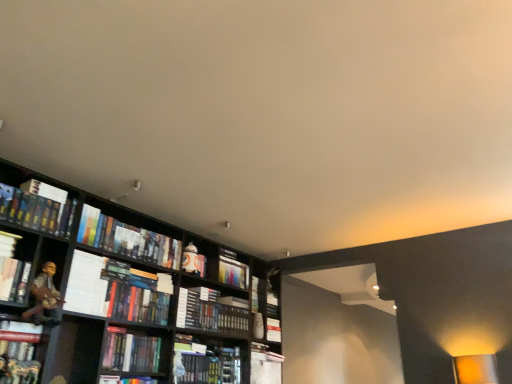
This screenshot has height=384, width=512. Find the location of `hardcover book at upper center, acting as the ninth book starting from the left`. hardcover book at upper center, acting as the ninth book starting from the left is located at coordinates (272, 304).

Measure the distance between hardcover book at center, positioned as the first book in right-to-left order, and camera.

A distance of 3.58 meters exists between hardcover book at center, positioned as the first book in right-to-left order, and camera.

The width and height of the screenshot is (512, 384). In order to click on hardcover book at left, positioned as the third book in left-to-right order in this screenshot , I will do `click(128, 239)`.

This screenshot has height=384, width=512. What do you see at coordinates (128, 239) in the screenshot? I see `hardcover book at left, positioned as the third book in left-to-right order` at bounding box center [128, 239].

What is the approximate height of white paper at left?

The height of white paper at left is 12.63 inches.

What do you see at coordinates (193, 261) in the screenshot? I see `white glossy figurine at center, which is the 6th book in left-to-right order` at bounding box center [193, 261].

Where is `hardcover book at upper center, acting as the ninth book starting from the left`? The height and width of the screenshot is (384, 512). hardcover book at upper center, acting as the ninth book starting from the left is located at coordinates (272, 304).

Are white paper at left and hardcover books at center, which is the seventh book from left to right, far apart?

No, white paper at left is not far away from hardcover books at center, which is the seventh book from left to right.

Between white paper at left and hardcover books at center, placed as the fourth book when sorted from right to left, which one has less height?

hardcover books at center, placed as the fourth book when sorted from right to left, is shorter.

What's the angular difference between white paper at left and hardcover books at center, placed as the fourth book when sorted from right to left,'s facing directions?

0.877 degrees.

Between white paper at left and hardcover books at center, placed as the fourth book when sorted from right to left, which one has smaller size?

With smaller size is white paper at left.

Does hardcover book at upper center, acting as the ninth book starting from the left, have a lesser height compared to hardcover book at center, the 7th book positioned from the right?

Yes.

Is hardcover book at upper center, arranged as the 2th book when viewed from the right, to the right of hardcover book at center, the 7th book positioned from the right, from the viewer's perspective?

Yes.

Is hardcover book at upper center, arranged as the 2th book when viewed from the right, positioned beyond the bounds of hardcover book at center, the fourth book positioned from the left?

Indeed, hardcover book at upper center, arranged as the 2th book when viewed from the right, is completely outside hardcover book at center, the fourth book positioned from the left.

At what (x,y) coordinates should I click in order to perform the action: click on book that is the 5th object located in front of the hardcover book at upper center, arranged as the 2th book when viewed from the right. Please return your answer as a coordinate pair (x, y). Looking at the image, I should click on (131, 351).

Is hardcover books at center, which is the seventh book from left to right, not close to hardcover book at center, positioned as the first book in right-to-left order?

No, hardcover books at center, which is the seventh book from left to right, is in close proximity to hardcover book at center, positioned as the first book in right-to-left order.

Can you confirm if hardcover books at center, placed as the fourth book when sorted from right to left, is smaller than hardcover book at center, positioned as the first book in right-to-left order?

Actually, hardcover books at center, placed as the fourth book when sorted from right to left, might be larger than hardcover book at center, positioned as the first book in right-to-left order.

Which is farther, (192, 300) or (277, 339)?

The point (277, 339) is farther.

From the image's perspective, is hardcover book at left, acting as the 10th book starting from the right, below white paper at left?

Incorrect, from the image's perspective, hardcover book at left, acting as the 10th book starting from the right, is higher than white paper at left.

Is hardcover book at left, the 1th book positioned from the left, not close to white paper at left?

No, hardcover book at left, the 1th book positioned from the left, is not far away from white paper at left.

Could you measure the distance between hardcover book at left, acting as the 10th book starting from the right, and white paper at left?

The distance of hardcover book at left, acting as the 10th book starting from the right, from white paper at left is 12.31 inches.

In terms of height, does hardcover book at left, the 1th book positioned from the left, look taller or shorter compared to white paper at left?

Considering their sizes, hardcover book at left, the 1th book positioned from the left, has less height than white paper at left.

Does hardcover book at upper center, arranged as the 2th book when viewed from the right, have a greater width compared to hardcover books at center, which is the seventh book from left to right?

No, hardcover book at upper center, arranged as the 2th book when viewed from the right, is not wider than hardcover books at center, which is the seventh book from left to right.

Is hardcover book at upper center, arranged as the 2th book when viewed from the right, next to hardcover books at center, placed as the fourth book when sorted from right to left, and touching it?

There is a gap between hardcover book at upper center, arranged as the 2th book when viewed from the right, and hardcover books at center, placed as the fourth book when sorted from right to left.

Is hardcover book at upper center, arranged as the 2th book when viewed from the right, positioned beyond the bounds of hardcover books at center, which is the seventh book from left to right?

Yes, hardcover book at upper center, arranged as the 2th book when viewed from the right, is not within hardcover books at center, which is the seventh book from left to right.

From the image's perspective, is hardcover book at upper center, arranged as the 2th book when viewed from the right, located above hardcover books at center, placed as the fourth book when sorted from right to left?

Actually, hardcover book at upper center, arranged as the 2th book when viewed from the right, appears below hardcover books at center, placed as the fourth book when sorted from right to left, in the image.

From the image's perspective, is hardcover book at center, the tenth book from the left, positioned above or below hardcover book at center, arranged as the 5th book when viewed from the left?

hardcover book at center, the tenth book from the left, is below hardcover book at center, arranged as the 5th book when viewed from the left.

Does point (269, 334) appear closer or farther from the camera than point (149, 320)?

Point (269, 334) is farther from the camera than point (149, 320).

Can you confirm if hardcover book at center, the tenth book from the left, is thinner than hardcover book at center, marked as the sixth book in a right-to-left arrangement?

Yes.

Which object is positioned more to the right, hardcover book at center, the tenth book from the left, or hardcover book at center, marked as the sixth book in a right-to-left arrangement?

Positioned to the right is hardcover book at center, the tenth book from the left.

Is the depth of hardcover book at center, marked as the sixth book in a right-to-left arrangement, greater than that of white paper at left?

Yes.

From the picture: Considering the sizes of objects hardcover book at center, marked as the sixth book in a right-to-left arrangement, and white paper at left in the image provided, who is smaller, hardcover book at center, marked as the sixth book in a right-to-left arrangement, or white paper at left?

Smaller between the two is white paper at left.

How different are the orientations of hardcover book at center, arranged as the 5th book when viewed from the left, and white paper at left in degrees?

The facing directions of hardcover book at center, arranged as the 5th book when viewed from the left, and white paper at left are 0.00128 degrees apart.

Is hardcover book at center, marked as the sixth book in a right-to-left arrangement, facing towards white paper at left?

No, hardcover book at center, marked as the sixth book in a right-to-left arrangement, is not turned towards white paper at left.

From the image's perspective, count 5th books downward from the white paper at left and point to it. Please provide its 2D coordinates.

[(210, 313)]

Where is `book that is the 5th one when counting leftward from the hardcover book at upper center, arranged as the 2th book when viewed from the right`? This screenshot has width=512, height=384. book that is the 5th one when counting leftward from the hardcover book at upper center, arranged as the 2th book when viewed from the right is located at coordinates (131, 351).

Considering their positions, is hardcover book at center, arranged as the 5th book when viewed from the left, positioned closer to hardcover book at upper center, arranged as the 2th book when viewed from the right, than white glossy figurine at center, acting as the fifth book starting from the right?

The object closer to hardcover book at upper center, arranged as the 2th book when viewed from the right, is white glossy figurine at center, acting as the fifth book starting from the right.

Based on the photo, based on their spatial positions, is hardcover book at left, acting as the 10th book starting from the right, or hardcover book at upper center, arranged as the 2th book when viewed from the right, further from hardcover book at center, the tenth book from the left?

hardcover book at left, acting as the 10th book starting from the right, is positioned further to the anchor hardcover book at center, the tenth book from the left.

Estimate the real-world distances between objects in this image. Which object is further from hardcover book at upper center, arranged as the 2th book when viewed from the right, white glossy figurine at center, which is the 6th book in left-to-right order, or hardcover book at center, the 7th book positioned from the right?

hardcover book at center, the 7th book positioned from the right, is positioned further to the anchor hardcover book at upper center, arranged as the 2th book when viewed from the right.

Considering their positions, is hardcover book at upper center, arranged as the 2th book when viewed from the right, positioned closer to white glossy figurine at center, which is the 6th book in left-to-right order, than hardcover books at center, placed as the fourth book when sorted from right to left?

hardcover books at center, placed as the fourth book when sorted from right to left, lies closer to white glossy figurine at center, which is the 6th book in left-to-right order, than the other object.

Looking at the image, which one is located closer to hardcover book at center, arranged as the 5th book when viewed from the left, white glossy figurine at center, acting as the fifth book starting from the right, or hardcover book at center, positioned as the first book in right-to-left order?

white glossy figurine at center, acting as the fifth book starting from the right.

Which object lies nearer to the anchor point hardcover books at center, which is the seventh book from left to right, white paper at left or hardcover book at left, the 1th book positioned from the left?

white paper at left is closer to hardcover books at center, which is the seventh book from left to right.

Looking at the image, which one is located further to hardcover book at upper center, acting as the ninth book starting from the left, white glossy figurine at center, which is the 6th book in left-to-right order, or matte black book at lower left, acting as the ninth book starting from the right?

matte black book at lower left, acting as the ninth book starting from the right, is further to hardcover book at upper center, acting as the ninth book starting from the left.

From the image, which object appears to be farther from matte black book at lower left, acting as the ninth book starting from the right, white paper at left or hardcover books at center, which is the seventh book from left to right?

hardcover books at center, which is the seventh book from left to right.

The width and height of the screenshot is (512, 384). Find the location of `paperback book between hardcover book at left, positioned as the third book in left-to-right order, and hardcover book at center, marked as the sixth book in a right-to-left arrangement, in the vertical direction`. paperback book between hardcover book at left, positioned as the third book in left-to-right order, and hardcover book at center, marked as the sixth book in a right-to-left arrangement, in the vertical direction is located at coordinates (86, 285).

I want to click on paperback book between hardcover book at left, acting as the 10th book starting from the right, and hardcover book at center, arranged as the 5th book when viewed from the left, from top to bottom, so click(x=86, y=285).

The image size is (512, 384). Identify the location of paperback book situated between hardcover book at left, the 1th book positioned from the left, and hardcover book at left, positioned as the third book in left-to-right order, from left to right. (86, 285).

Find the location of a particular element. paperback book located between matte black book at lower left, acting as the ninth book starting from the right, and white glossy figurine at center, acting as the fifth book starting from the right, in the depth direction is located at coordinates (86, 285).